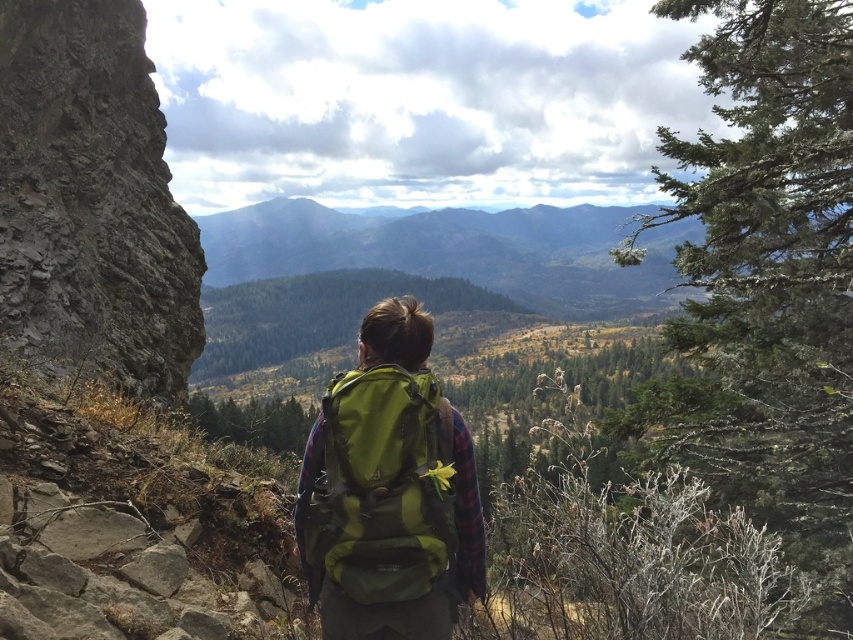
You are the hiker in the image. You want to move from your current position to a point that is behind you. Which of the two points, point (39,118) or point (372,369), should you move towards?

You should move towards point (39,118) because it is behind point (372,369).

You are a hiker preparing to cross a rocky area. You notice a gray rough rock at left and a green fabric backpack at center. Which object is bigger in size?

The gray rough rock at left is larger in size compared to the green fabric backpack at center according to the description.

You are a hiker planning to place a lightweight tent on the ground near the gray rough rock at left and the green fabric backpack at center. Based on their positions, can you determine which object is higher up the cliff face?

The gray rough rock at left is above the green fabric backpack at center, so the gray rough rock at left is higher up the cliff face than the green fabric backpack at center.